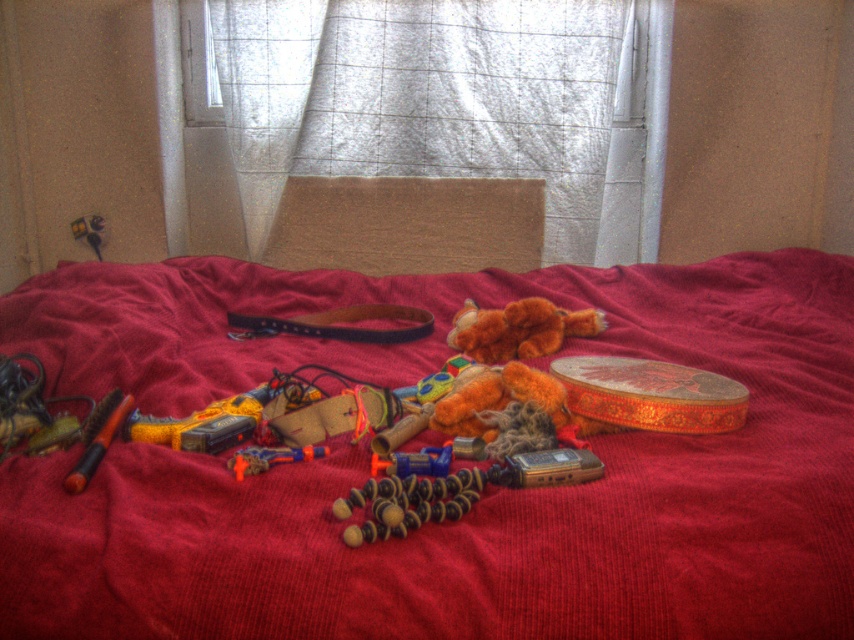
You are organizing the items on the bed and need to place the white sheer curtain at upper center and the orange matte pen at lower left. Which item requires a larger storage space?

The white sheer curtain at upper center requires a larger storage space because it is larger in size than the orange matte pen at lower left.

You are organizing the bed and want to place the wooden beads at center and the orange plastic toy gun at center in a specific order. According to the image, which item is positioned to the right of the other?

The wooden beads at center are to the right of the orange plastic toy gun at center.